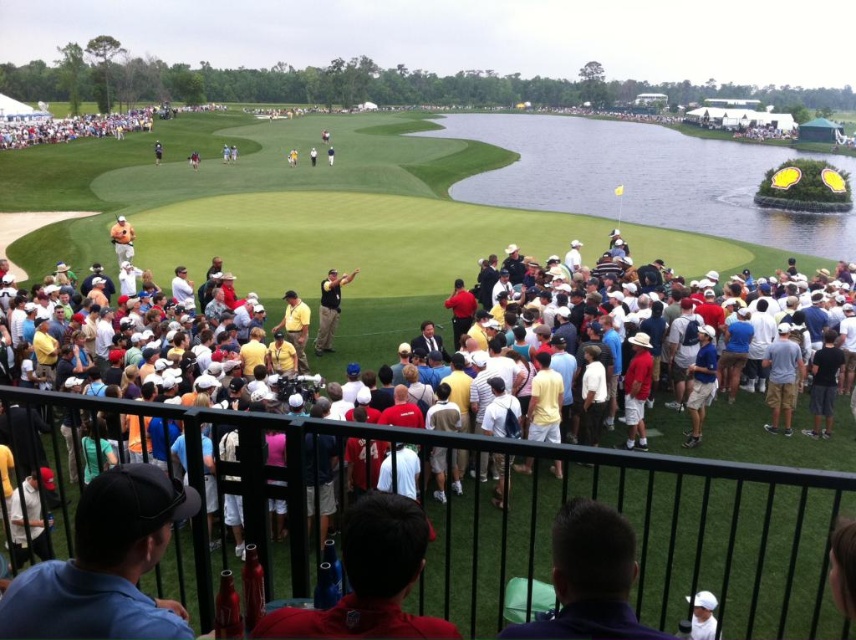
Question: Does yellow cotton shirt at center appear on the left side of black cotton shirt at lower right?

Choices:
 (A) no
 (B) yes

Answer: (B)

Question: Among these points, which one is nearest to the camera?

Choices:
 (A) (603, 124)
 (B) (782, 392)
 (C) (837, 346)

Answer: (B)

Question: Which point appears closest to the camera in this image?

Choices:
 (A) (539, 129)
 (B) (777, 330)
 (C) (545, 413)
 (D) (837, 369)

Answer: (C)

Question: Which object appears farthest from the camera in this image?

Choices:
 (A) gray cotton shorts at lower right
 (B) yellow cotton shirt at center

Answer: (A)

Question: Can you confirm if green water at center is positioned below black cotton shirt at lower right?

Choices:
 (A) yes
 (B) no

Answer: (B)

Question: Can you confirm if green water at center is positioned below yellow cotton shirt at center?

Choices:
 (A) yes
 (B) no

Answer: (B)